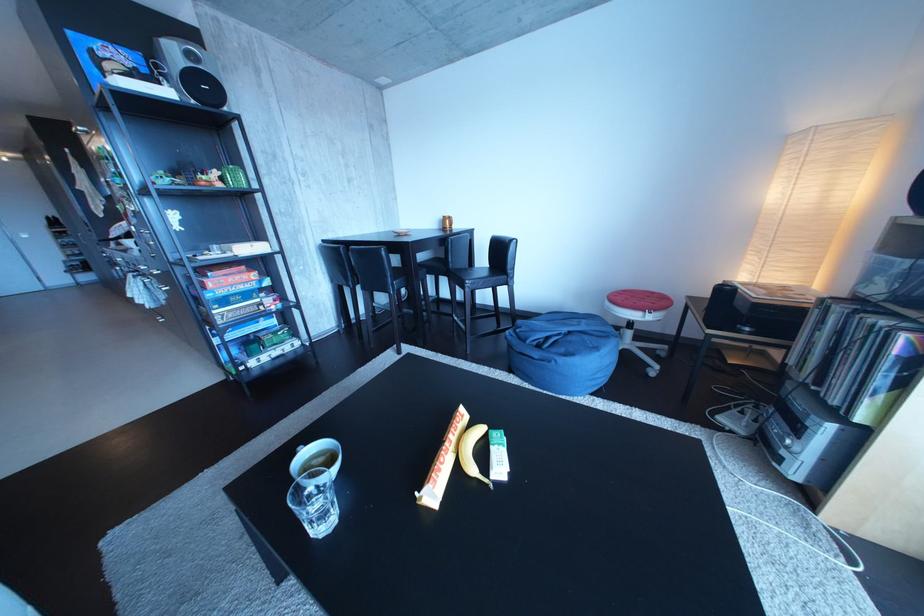
This screenshot has width=924, height=616. Identify the location of white remote control. (738, 416).